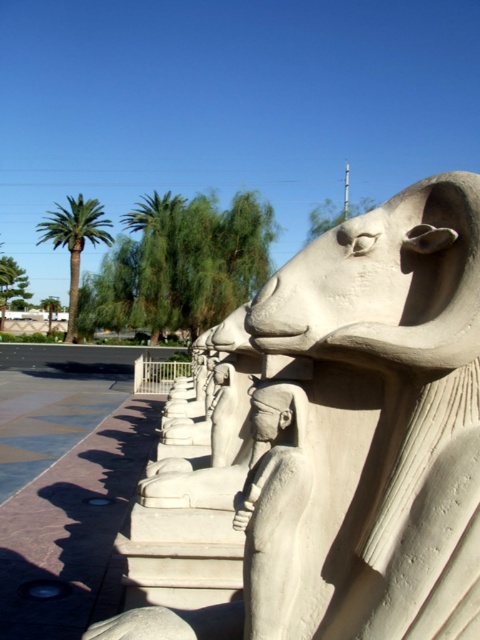
Which is in front, point (160, 205) or point (61, 225)?

Point (160, 205) is more forward.

Which is more to the left, green leafy palm tree at upper center or green leafy palm at left?

From the viewer's perspective, green leafy palm at left appears more on the left side.

Which is behind, point (177, 225) or point (97, 224)?

Positioned behind is point (97, 224).

At what (x,y) coordinates should I click in order to perform the action: click on green leafy palm tree at upper center. Please return your answer as a coordinate pair (x, y). This screenshot has width=480, height=640. Looking at the image, I should click on (156, 256).

Does point (360, 266) lie in front of point (107, 244)?

Yes, point (360, 266) is closer to viewer.

Does white stone sphinx at center have a lesser width compared to green leafy palm at left?

Correct, white stone sphinx at center's width is less than green leafy palm at left's.

Does point (222, 364) lie in front of point (94, 227)?

Yes, point (222, 364) is closer to viewer.

This screenshot has height=640, width=480. I want to click on white stone sphinx at center, so click(331, 445).

Can you confirm if white stone sphinx at center is wider than green leafy palm tree at upper center?

No, white stone sphinx at center is not wider than green leafy palm tree at upper center.

From the picture: Is white stone sphinx at center positioned at the back of green leafy palm tree at upper center?

No, white stone sphinx at center is in front of green leafy palm tree at upper center.

The width and height of the screenshot is (480, 640). In order to click on white stone sphinx at center in this screenshot , I will do `click(331, 445)`.